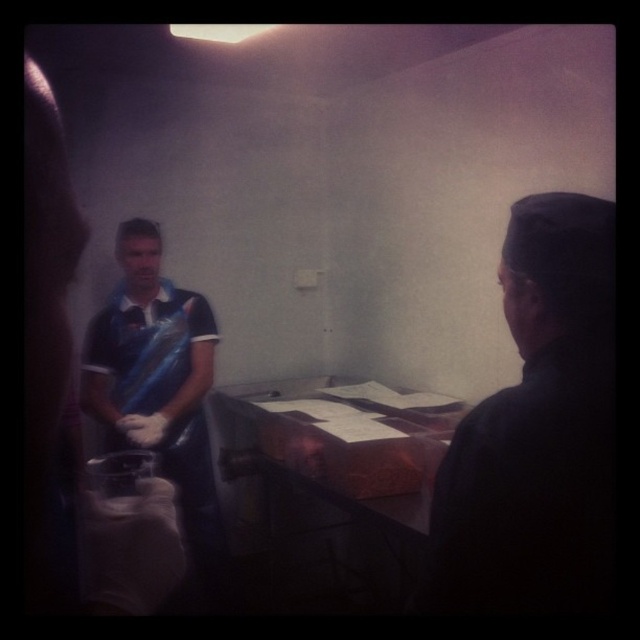
Question: Is dark matte cap at right positioned before blue plastic bag at left?

Choices:
 (A) yes
 (B) no

Answer: (A)

Question: Which point appears farthest from the camera in this image?

Choices:
 (A) (477, 577)
 (B) (168, 365)

Answer: (B)

Question: Is dark matte cap at right to the left of blue plastic bag at left from the viewer's perspective?

Choices:
 (A) yes
 (B) no

Answer: (B)

Question: From the image, what is the correct spatial relationship of dark matte cap at right in relation to blue plastic bag at left?

Choices:
 (A) right
 (B) left

Answer: (A)

Question: Which object appears farthest from the camera in this image?

Choices:
 (A) dark matte cap at right
 (B) blue plastic bag at left

Answer: (B)